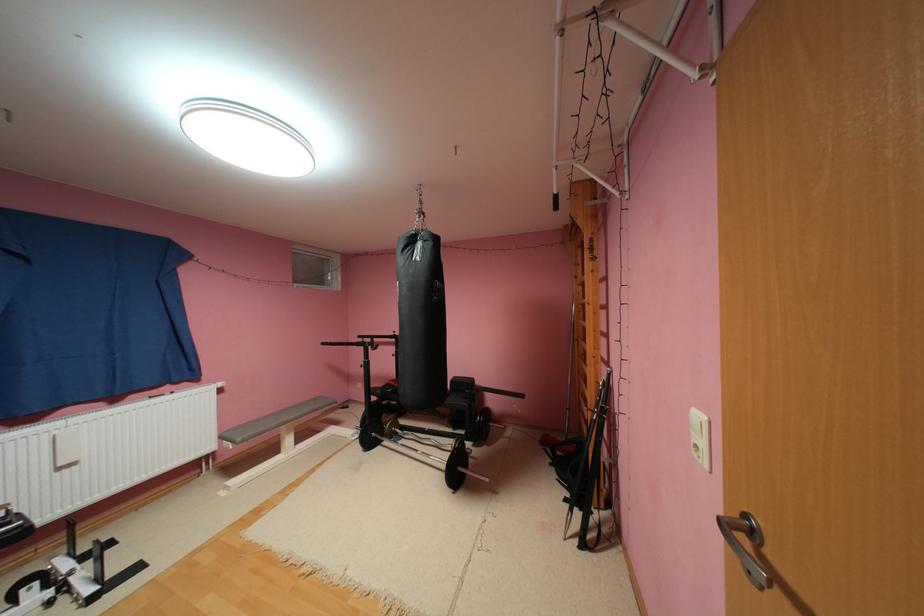
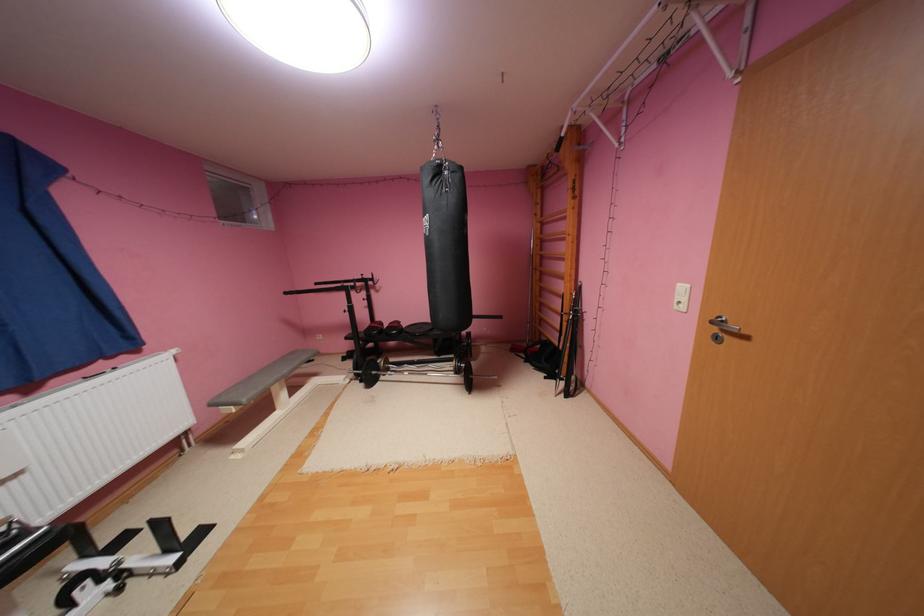
Find the pixel in the second image that matches (x=575, y=500) in the first image.

(554, 378)